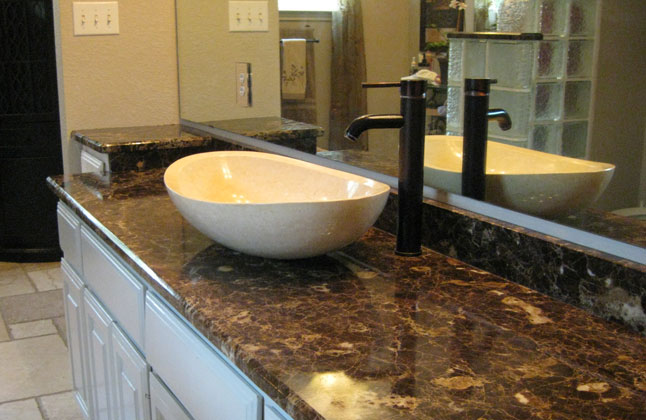
I want to click on hand towel, so click(x=297, y=52).